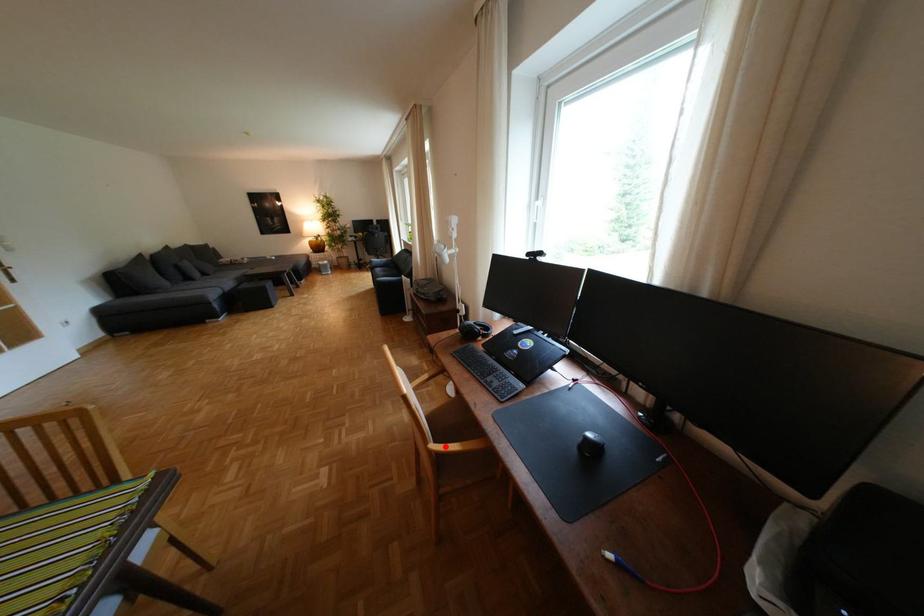
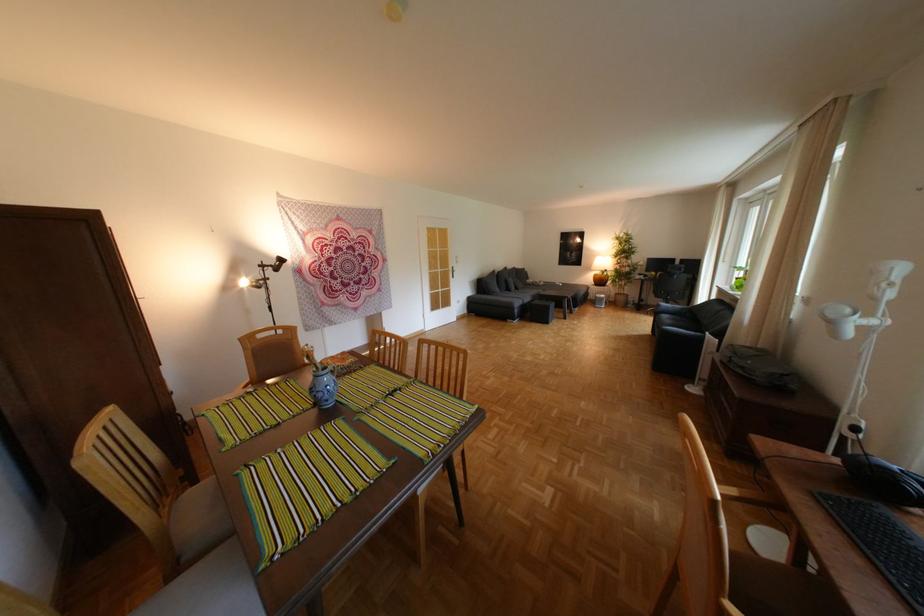
Where in the second image is the point corresponding to the highlighted location from the first image?

(744, 608)